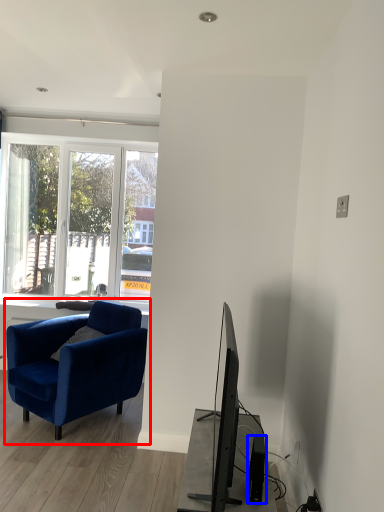
Question: Among these objects, which one is farthest to the camera, chair (highlighted by a red box) or speaker (highlighted by a blue box)?

Choices:
 (A) chair
 (B) speaker

Answer: (A)